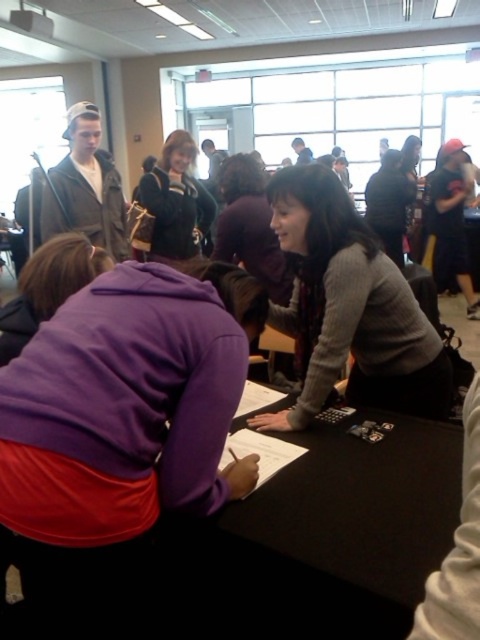
Who is lower down, gray sweater at center or matte black hoodie at center?

Positioned lower is gray sweater at center.

Does gray sweater at center have a greater width compared to matte black hoodie at center?

Yes, gray sweater at center is wider than matte black hoodie at center.

Is point (315, 180) positioned behind point (177, 154)?

No, it is in front of (177, 154).

The height and width of the screenshot is (640, 480). What are the coordinates of `gray sweater at center` in the screenshot? It's located at (348, 308).

Can you confirm if dark gray sweater at center is smaller than matte black hoodie at center?

Correct, dark gray sweater at center occupies less space than matte black hoodie at center.

Who is more forward, (237, 157) or (166, 152)?

Point (237, 157) is more forward.

Which is in front, point (227, 200) or point (181, 228)?

Point (227, 200)

Find the location of `dark gray sweater at center`. dark gray sweater at center is located at coordinates (250, 227).

Which is in front, point (252, 604) or point (239, 221)?

Point (252, 604) is in front.

Can you confirm if black matte table at center is positioned to the right of dark gray sweater at center?

Yes, black matte table at center is to the right of dark gray sweater at center.

Between point (304, 561) and point (226, 248), which one is positioned in front?

Point (304, 561) is more forward.

This screenshot has height=640, width=480. What are the coordinates of `black matte table at center` in the screenshot? It's located at (337, 536).